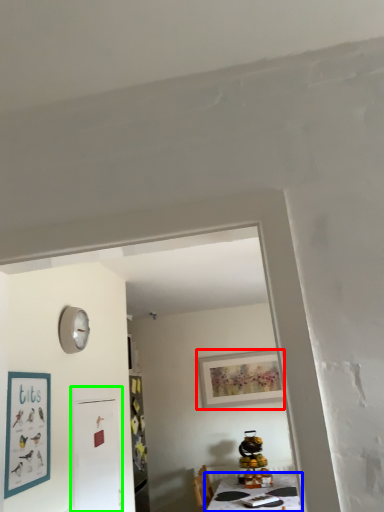
Question: Which object is the farthest from picture frame (highlighted by a red box)? Choose among these: table (highlighted by a blue box) or fridge (highlighted by a green box).

Choices:
 (A) table
 (B) fridge

Answer: (B)